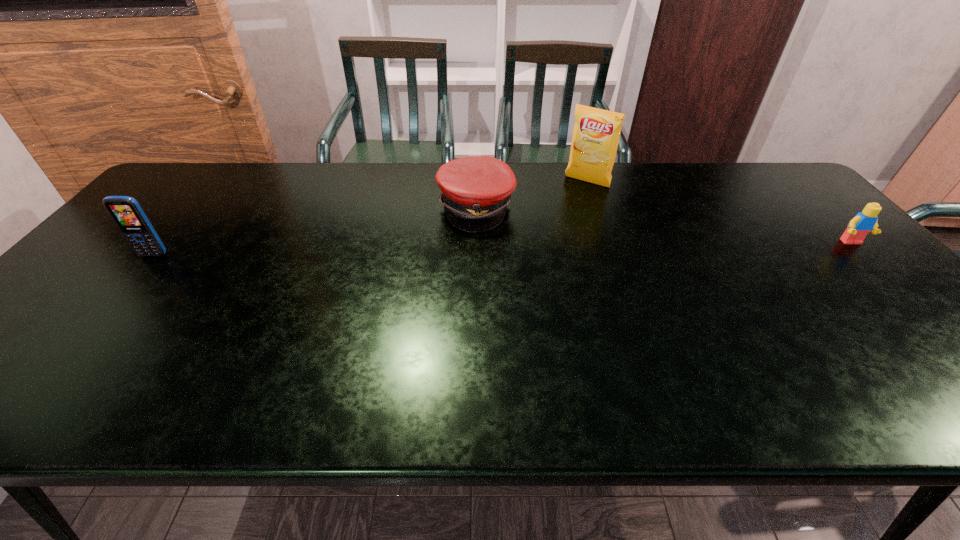
I want to click on vacant area that lies between the second tallest object and the second nearest object, so click(503, 248).

Locate an element on the screen. The width and height of the screenshot is (960, 540). object that stands as the third closest to the cap is located at coordinates (865, 221).

Select which object is the third closest to the second object from right to left. Please provide its 2D coordinates. Your answer should be formatted as a tuple, i.e. [(x, y)], where the tuple contains the x and y coordinates of a point satisfying the conditions above.

[(127, 213)]

Image resolution: width=960 pixels, height=540 pixels. I want to click on vacant space that satisfies the following two spatial constraints: 1. on the back side of the cap; 2. on the left side of the second object from right to left, so click(476, 182).